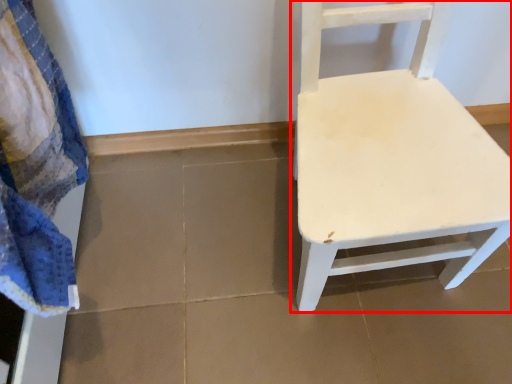
Question: From the image's perspective, where is chair (annotated by the red box) located in relation to bath towel in the image?

Choices:
 (A) below
 (B) above

Answer: (B)